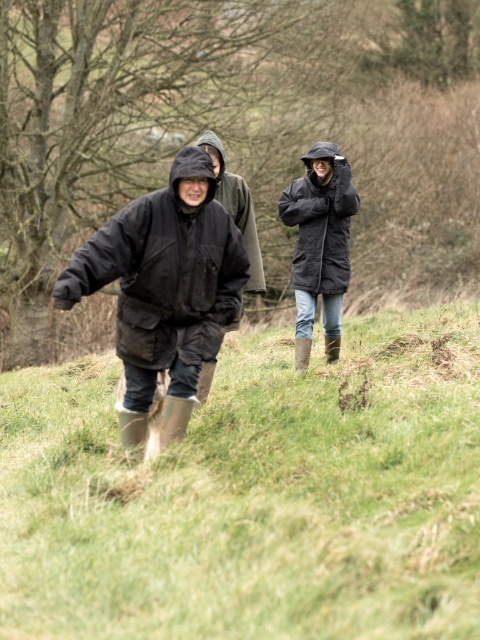
Question: Which point is closer to the camera taking this photo?

Choices:
 (A) [x=76, y=260]
 (B) [x=34, y=604]
 (C) [x=308, y=252]

Answer: (B)

Question: Estimate the real-world distances between objects in this image. Which object is farther from the black matte jacket at upper center?

Choices:
 (A) black matte jacket at center
 (B) green grassy at lower left

Answer: (B)

Question: Which of the following is the closest to the observer?

Choices:
 (A) green grassy at lower left
 (B) black matte jacket at center

Answer: (A)

Question: Does green grassy at lower left appear under black matte jacket at upper center?

Choices:
 (A) no
 (B) yes

Answer: (B)

Question: Can you confirm if green grassy at lower left is thinner than black matte jacket at upper center?

Choices:
 (A) no
 (B) yes

Answer: (B)

Question: Is black matte jacket at center positioned at the back of black matte jacket at upper center?

Choices:
 (A) yes
 (B) no

Answer: (B)